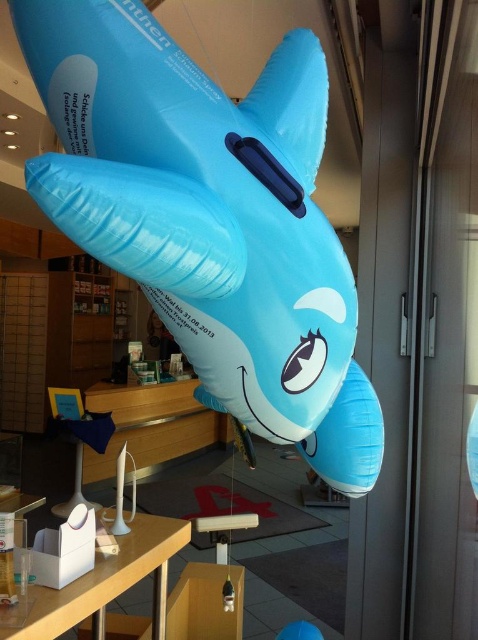
Between blue rubber dolphin at center and blue inflatable shark at center, which one appears on the right side from the viewer's perspective?

Positioned to the right is blue rubber dolphin at center.

Who is more distant from viewer, (373, 397) or (293, 625)?

The point (293, 625) is more distant.

Is point (302, 444) closer to camera compared to point (307, 637)?

That is True.

This screenshot has width=478, height=640. I want to click on blue rubber dolphin at center, so click(348, 436).

Is blue inflatable dolphin at center smaller than blue rubber dolphin at center?

Actually, blue inflatable dolphin at center might be larger than blue rubber dolphin at center.

Who is lower down, blue inflatable dolphin at center or blue rubber dolphin at center?

blue rubber dolphin at center is below.

Find the location of a particular element. This screenshot has height=640, width=478. blue inflatable dolphin at center is located at coordinates (199, 202).

Who is higher up, white plastic table at lower center or blue inflatable shark at center?

Positioned higher is white plastic table at lower center.

Is white plastic table at lower center wider than blue inflatable shark at center?

Yes.

Consider the image. Who is more forward, (47, 588) or (310, 628)?

Point (47, 588) is more forward.

Locate an element on the screen. The height and width of the screenshot is (640, 478). white plastic table at lower center is located at coordinates (108, 582).